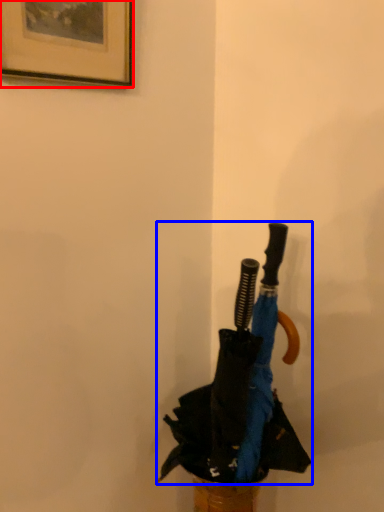
Question: Which point is closer to the camera, picture frame (highlighted by a red box) or umbrella (highlighted by a blue box)?

Choices:
 (A) picture frame
 (B) umbrella

Answer: (A)